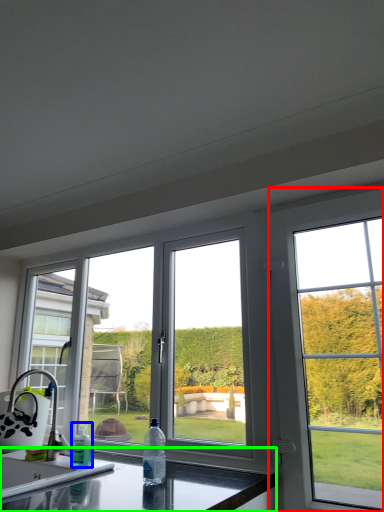
Question: Considering the real-world distances, which object is farthest from window (highlighted by a red box)? bottle (highlighted by a blue box) or countertop (highlighted by a green box)?

Choices:
 (A) bottle
 (B) countertop

Answer: (A)